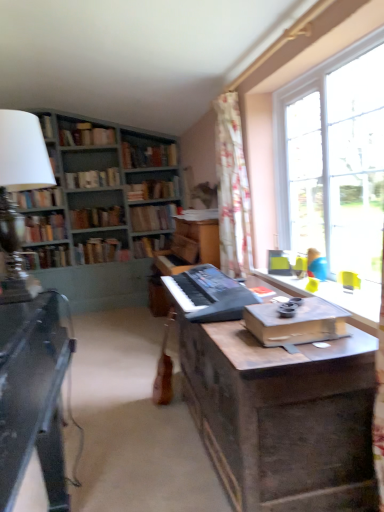
Question: Is hardcover book at center-left, positioned as the second book in bottom-to-top order, facing towards hardcover book at center, which is the sixth book in top-to-bottom order?

Choices:
 (A) yes
 (B) no

Answer: (B)

Question: Considering the relative sizes of hardcover book at center-left, positioned as the second book in bottom-to-top order, and hardcover book at center, which is the sixth book in top-to-bottom order, in the image provided, is hardcover book at center-left, positioned as the second book in bottom-to-top order, wider than hardcover book at center, which is the sixth book in top-to-bottom order,?

Choices:
 (A) no
 (B) yes

Answer: (B)

Question: Is hardcover book at center, the 6th book positioned from the bottom, at the back of hardcover book at center-left, positioned as the second book in bottom-to-top order?

Choices:
 (A) yes
 (B) no

Answer: (B)

Question: Is hardcover book at center-left, the 10th book in the top-to-bottom sequence, located outside hardcover book at center, which is the sixth book in top-to-bottom order?

Choices:
 (A) yes
 (B) no

Answer: (A)

Question: Is hardcover book at center-left, the 10th book in the top-to-bottom sequence, to the right of hardcover book at center, which is the sixth book in top-to-bottom order, from the viewer's perspective?

Choices:
 (A) yes
 (B) no

Answer: (B)

Question: Considering the positions of point (69, 141) and point (322, 154), is point (69, 141) closer or farther from the camera than point (322, 154)?

Choices:
 (A) closer
 (B) farther

Answer: (B)

Question: Would you say hardcover books at upper left, which ranks as the 1th book in top-to-bottom order, is inside or outside clear glass window at upper right?

Choices:
 (A) outside
 (B) inside

Answer: (A)

Question: Based on their sizes in the image, would you say hardcover books at upper left, which ranks as the 1th book in top-to-bottom order, is bigger or smaller than clear glass window at upper right?

Choices:
 (A) small
 (B) big

Answer: (A)

Question: From a real-world perspective, is hardcover books at upper left, acting as the 11th book starting from the bottom, positioned above or below clear glass window at upper right?

Choices:
 (A) above
 (B) below

Answer: (A)

Question: Is floral fabric curtain at upper right inside the boundaries of wooden bookshelf at center, marked as the third book in a bottom-to-top arrangement, or outside?

Choices:
 (A) outside
 (B) inside

Answer: (A)

Question: Visually, is floral fabric curtain at upper right positioned to the left or to the right of wooden bookshelf at center, acting as the ninth book starting from the top?

Choices:
 (A) right
 (B) left

Answer: (A)

Question: In terms of size, does floral fabric curtain at upper right appear bigger or smaller than wooden bookshelf at center, marked as the third book in a bottom-to-top arrangement?

Choices:
 (A) big
 (B) small

Answer: (A)

Question: From a real-world perspective, is floral fabric curtain at upper right physically located above or below wooden bookshelf at center, acting as the ninth book starting from the top?

Choices:
 (A) below
 (B) above

Answer: (B)

Question: Does point (342, 62) appear closer or farther from the camera than point (66, 172)?

Choices:
 (A) farther
 (B) closer

Answer: (B)

Question: Looking at their shapes, would you say clear glass window at upper right is wider or thinner than green painted wood bookcase at upper left?

Choices:
 (A) wide
 (B) thin

Answer: (B)